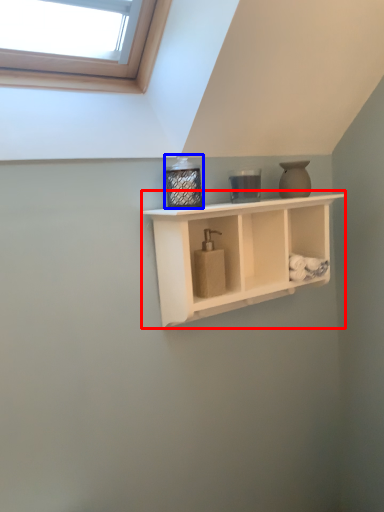
Question: Which object is further to the camera taking this photo, shelf (highlighted by a red box) or bottle (highlighted by a blue box)?

Choices:
 (A) shelf
 (B) bottle

Answer: (B)